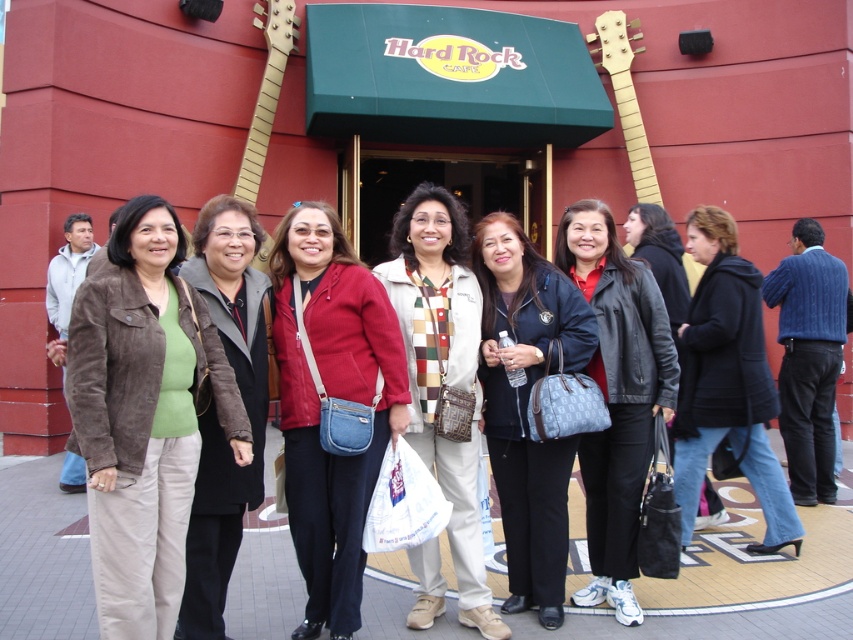
Can you confirm if matte beige scarf at center is positioned to the left of brown suede jacket at left?

In fact, matte beige scarf at center is to the right of brown suede jacket at left.

Does matte beige scarf at center come in front of brown suede jacket at left?

No.

The height and width of the screenshot is (640, 853). Find the location of `matte beige scarf at center`. matte beige scarf at center is located at coordinates (444, 371).

Between denim jacket at center and matte black jacket at center, which one appears on the right side from the viewer's perspective?

Positioned to the right is matte black jacket at center.

Identify the location of denim jacket at center. The width and height of the screenshot is (853, 640). (332, 397).

Is suede brown jacket at center closer to camera compared to brown suede jacket at left?

That is True.

What do you see at coordinates (143, 416) in the screenshot? I see `suede brown jacket at center` at bounding box center [143, 416].

Locate an element on the screen. suede brown jacket at center is located at coordinates (143, 416).